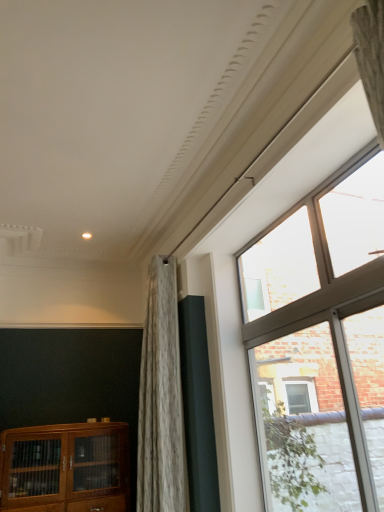
Question: Should I look upward or downward to see wooden cabinet at lower left?

Choices:
 (A) up
 (B) down

Answer: (B)

Question: Is wooden cabinet at lower left positioned with its back to clear glass window at upper right?

Choices:
 (A) no
 (B) yes

Answer: (A)

Question: Does wooden cabinet at lower left appear on the right side of clear glass window at upper right?

Choices:
 (A) no
 (B) yes

Answer: (A)

Question: From the image's perspective, would you say wooden cabinet at lower left is shown under clear glass window at upper right?

Choices:
 (A) yes
 (B) no

Answer: (A)

Question: From the image's perspective, is wooden cabinet at lower left above clear glass window at upper right?

Choices:
 (A) yes
 (B) no

Answer: (B)

Question: From a real-world perspective, is wooden cabinet at lower left physically above clear glass window at upper right?

Choices:
 (A) yes
 (B) no

Answer: (B)

Question: Is wooden cabinet at lower left behind clear glass window at upper right?

Choices:
 (A) no
 (B) yes

Answer: (B)

Question: Is clear glass window at upper right to the right of wooden cabinet at lower left from the viewer's perspective?

Choices:
 (A) yes
 (B) no

Answer: (A)

Question: From the image's perspective, is clear glass window at upper right beneath wooden cabinet at lower left?

Choices:
 (A) no
 (B) yes

Answer: (A)

Question: Is clear glass window at upper right at the left side of wooden cabinet at lower left?

Choices:
 (A) yes
 (B) no

Answer: (B)

Question: Can wooden cabinet at lower left be found inside clear glass window at upper right?

Choices:
 (A) yes
 (B) no

Answer: (B)

Question: Is clear glass window at upper right smaller than wooden cabinet at lower left?

Choices:
 (A) no
 (B) yes

Answer: (B)

Question: Are clear glass window at upper right and wooden cabinet at lower left making contact?

Choices:
 (A) yes
 (B) no

Answer: (B)

Question: Considering the relative positions of wooden cabinet at lower left and clear glass window at upper right in the image provided, is wooden cabinet at lower left to the left or to the right of clear glass window at upper right?

Choices:
 (A) right
 (B) left

Answer: (B)